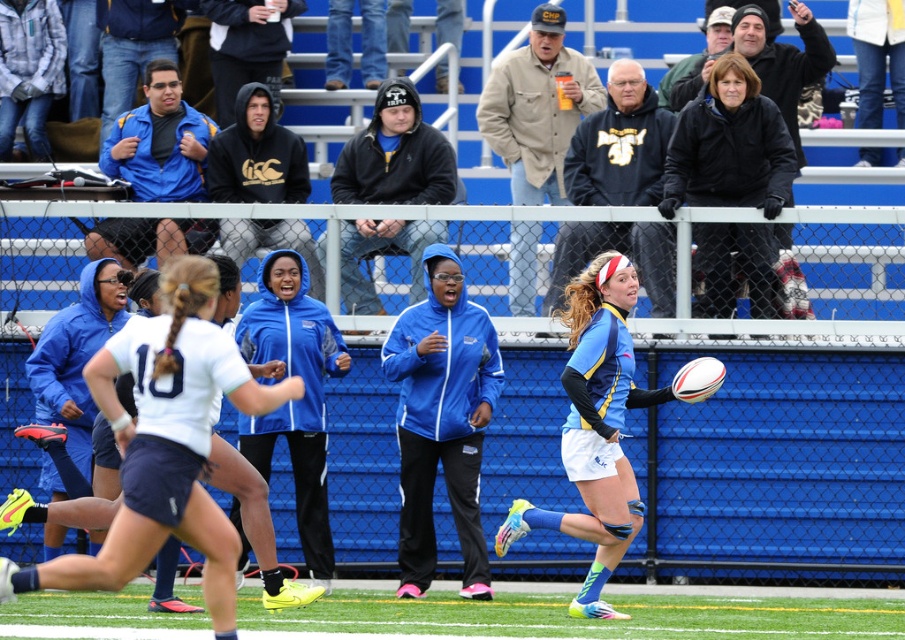
Question: Based on their relative distances, which object is farther from the light blue jersey at center?

Choices:
 (A) white matte jersey at center
 (B) black matte jacket at upper right

Answer: (A)

Question: Is white matte jersey at center closer to the viewer compared to black matte jacket at upper right?

Choices:
 (A) yes
 (B) no

Answer: (A)

Question: Which object is closer to the camera taking this photo?

Choices:
 (A) light blue jersey at center
 (B) white matte jersey at center
 (C) black matte jacket at upper right

Answer: (B)

Question: Among these objects, which one is nearest to the camera?

Choices:
 (A) light blue jersey at center
 (B) white matte jersey at center
 (C) black matte jacket at upper right

Answer: (B)

Question: Can you confirm if light blue jersey at center is bigger than black matte jacket at upper right?

Choices:
 (A) yes
 (B) no

Answer: (A)

Question: Considering the relative positions of white matte jersey at center and black matte jacket at upper right in the image provided, where is white matte jersey at center located with respect to black matte jacket at upper right?

Choices:
 (A) right
 (B) left

Answer: (B)